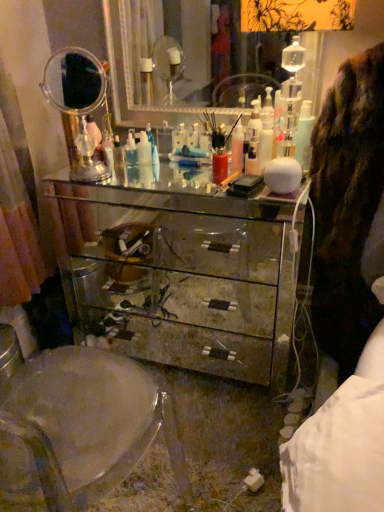
Question: Based on their sizes in the image, would you say transparent plastic swivel chair at center is bigger or smaller than silver mirrored dresser at upper center, which is the second mirror from left to right?

Choices:
 (A) small
 (B) big

Answer: (B)

Question: In terms of height, does transparent plastic swivel chair at center look taller or shorter compared to silver mirrored dresser at upper center, which is the second mirror from left to right?

Choices:
 (A) tall
 (B) short

Answer: (A)

Question: Which is nearer to the mirrored glass chest of drawers at center?

Choices:
 (A) white glossy bottle at upper right
 (B) transparent plastic swivel chair at center
 (C) silver mirrored dresser at upper center, the 1th mirror viewed from the right
 (D) clear glass mirror at upper left, the second mirror viewed from the right

Answer: (D)

Question: Which of these objects is positioned farthest from the transparent plastic swivel chair at center?

Choices:
 (A) clear glass mirror at upper left, positioned as the first mirror in left-to-right order
 (B) white glossy bottle at upper right
 (C) mirrored glass chest of drawers at center
 (D) silver mirrored dresser at upper center, the 1th mirror viewed from the right

Answer: (D)